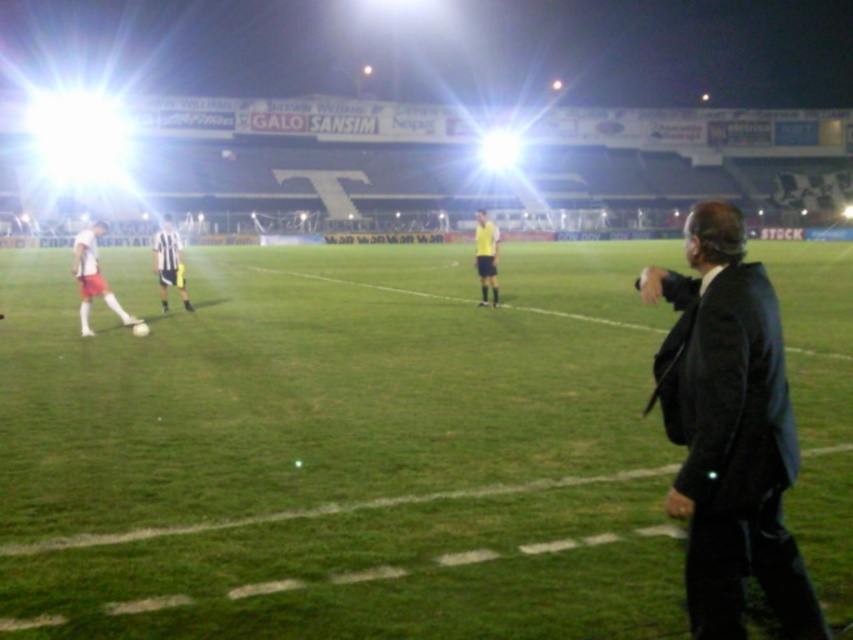
You are a photographer standing at the center of the soccer field during a nighttime match. You want to take a photo of the matte red shorts at left. Where should you point your camera to capture it?

You should point your camera towards the coordinates point [93,276] to capture the matte red shorts at left.